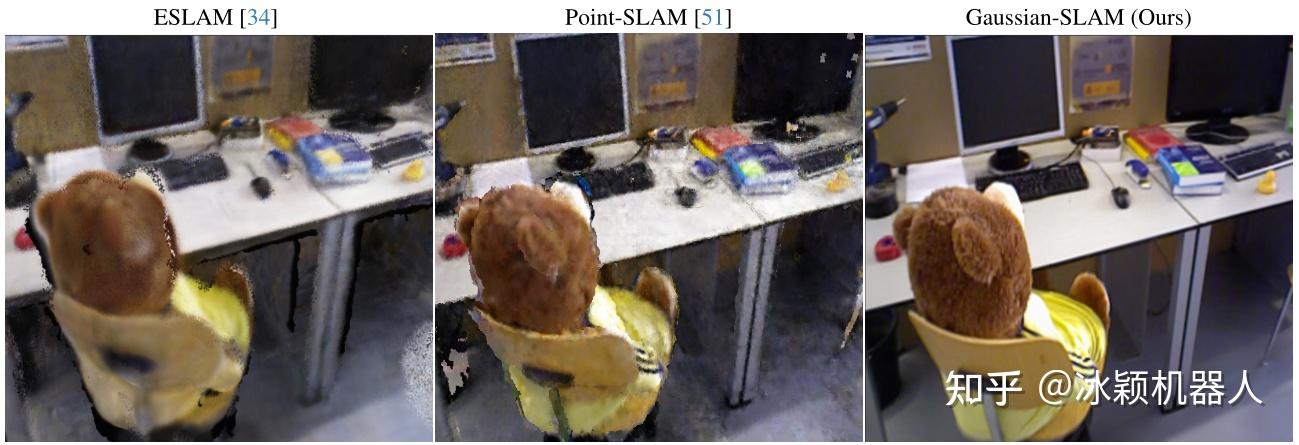
The height and width of the screenshot is (445, 1299). I want to click on teddy bear sitting in an office, so click(x=989, y=256).